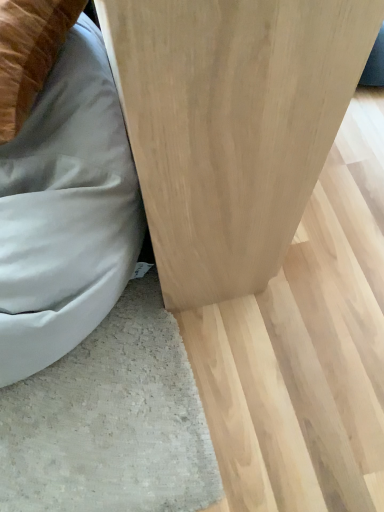
Question: Is natural wood table at center situated inside light gray fabric bean bag at lower left or outside?

Choices:
 (A) outside
 (B) inside

Answer: (A)

Question: From a real-world perspective, relative to light gray fabric bean bag at lower left, is natural wood table at center vertically above or below?

Choices:
 (A) below
 (B) above

Answer: (B)

Question: From the image's perspective, is natural wood table at center located above or below light gray fabric bean bag at lower left?

Choices:
 (A) below
 (B) above

Answer: (B)

Question: Is light gray fabric bean bag at lower left bigger or smaller than natural wood table at center?

Choices:
 (A) small
 (B) big

Answer: (A)

Question: From the image's perspective, is light gray fabric bean bag at lower left positioned above or below natural wood table at center?

Choices:
 (A) above
 (B) below

Answer: (B)

Question: Considering the positions of point (96, 134) and point (244, 18), is point (96, 134) closer or farther from the camera than point (244, 18)?

Choices:
 (A) farther
 (B) closer

Answer: (A)

Question: In terms of width, does light gray fabric bean bag at lower left look wider or thinner when compared to natural wood table at center?

Choices:
 (A) thin
 (B) wide

Answer: (A)